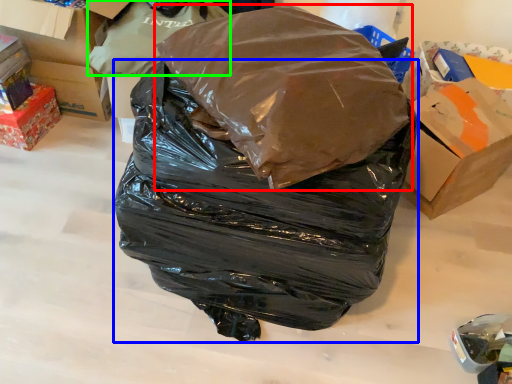
Question: Estimate the real-world distances between objects in this image. Which object is closer to plastic bag (highlighted by a red box), plastic bag (highlighted by a blue box) or plastic bag (highlighted by a green box)?

Choices:
 (A) plastic bag
 (B) plastic bag

Answer: (A)